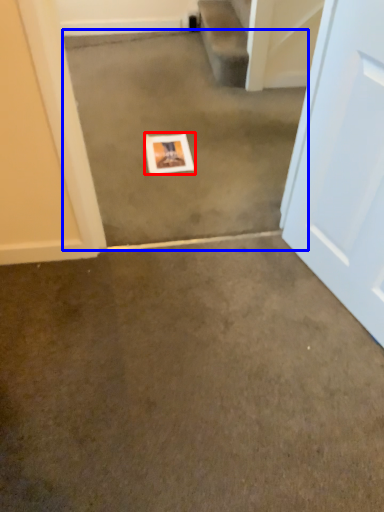
Question: Which object appears farthest to the camera in this image, picture frame (highlighted by a red box) or concrete (highlighted by a blue box)?

Choices:
 (A) picture frame
 (B) concrete

Answer: (A)